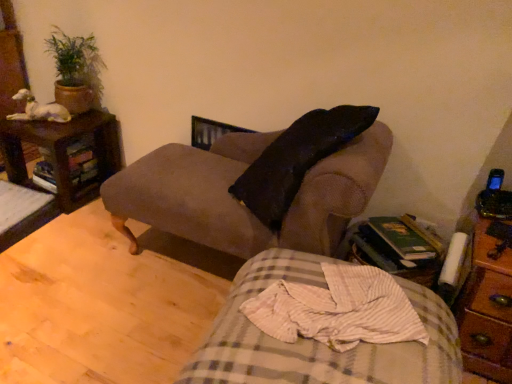
Image resolution: width=512 pixels, height=384 pixels. I want to click on vacant space underneath green leafy plant in pot at upper left (from a real-world perspective), so click(x=87, y=114).